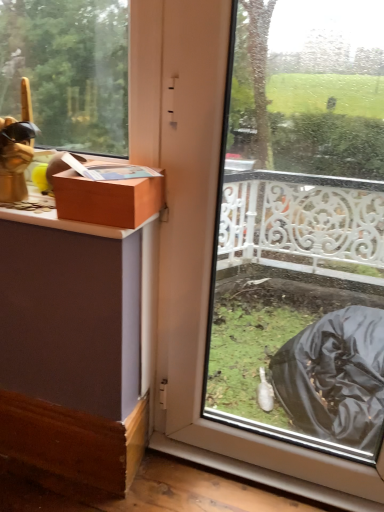
Question: Should I look upward or downward to see matte brown box at upper left?

Choices:
 (A) up
 (B) down

Answer: (A)

Question: Is transparent plastic bag at lower right wider than matte brown box at upper left?

Choices:
 (A) yes
 (B) no

Answer: (B)

Question: Is transparent plastic bag at lower right aimed at matte brown box at upper left?

Choices:
 (A) no
 (B) yes

Answer: (A)

Question: From a real-world perspective, is transparent plastic bag at lower right below matte brown box at upper left?

Choices:
 (A) no
 (B) yes

Answer: (B)

Question: Is transparent plastic bag at lower right not inside matte brown box at upper left?

Choices:
 (A) no
 (B) yes

Answer: (B)

Question: Is matte brown box at upper left at the back of transparent plastic bag at lower right?

Choices:
 (A) yes
 (B) no

Answer: (B)

Question: Is matte brown box at upper left a part of transparent plastic bag at lower right?

Choices:
 (A) yes
 (B) no

Answer: (B)

Question: Is the depth of matte brown box at upper left greater than that of transparent plastic bag at lower right?

Choices:
 (A) no
 (B) yes

Answer: (B)

Question: Is matte brown box at upper left outside transparent plastic bag at lower right?

Choices:
 (A) yes
 (B) no

Answer: (A)

Question: Is matte brown box at upper left smaller than transparent plastic bag at lower right?

Choices:
 (A) no
 (B) yes

Answer: (B)

Question: Is matte brown box at upper left to the right of transparent plastic bag at lower right from the viewer's perspective?

Choices:
 (A) yes
 (B) no

Answer: (B)

Question: From the image's perspective, is matte brown box at upper left under transparent plastic bag at lower right?

Choices:
 (A) yes
 (B) no

Answer: (B)

Question: From a real-world perspective, is matte brown box at upper left below transparent plastic bag at lower right?

Choices:
 (A) yes
 (B) no

Answer: (B)

Question: Is matte brown box at upper left to the left or to the right of transparent plastic bag at lower right in the image?

Choices:
 (A) right
 (B) left

Answer: (B)